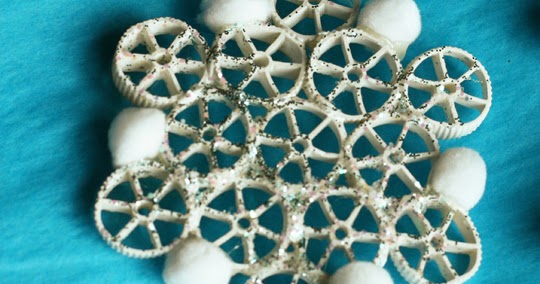
The image size is (540, 284). I want to click on white painted surface, so click(x=440, y=129).